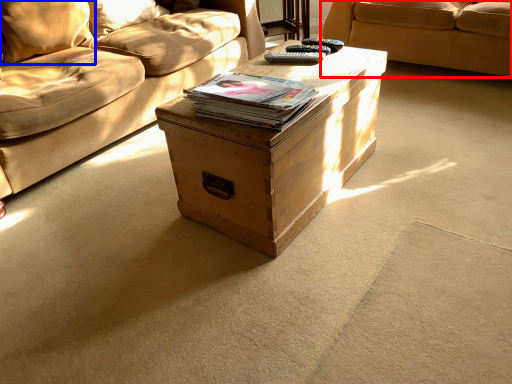
Question: Which point is closer to the camera, studio couch (highlighted by a red box) or pillow (highlighted by a blue box)?

Choices:
 (A) studio couch
 (B) pillow

Answer: (B)